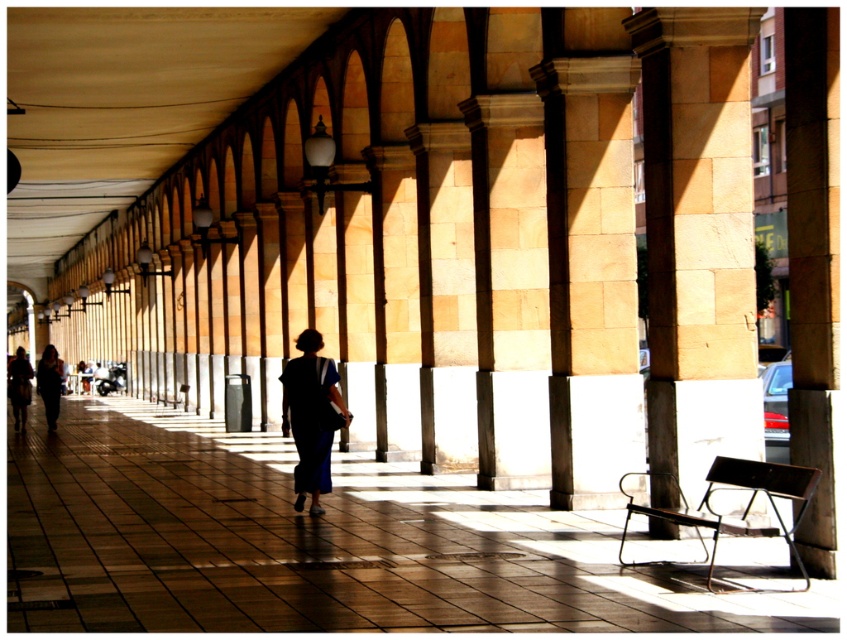
Question: Which point appears closest to the camera in this image?

Choices:
 (A) (832, 552)
 (B) (324, 445)
 (C) (21, 408)

Answer: (A)

Question: Among these objects, which one is nearest to the camera?

Choices:
 (A) dark blue dress at center
 (B) metallic brown chair at lower right
 (C) beige stone pillar at center
 (D) brown tile corridor at center

Answer: (D)

Question: Which object appears farthest from the camera in this image?

Choices:
 (A) dark blue dress at center
 (B) beige stone pillar at center
 (C) smooth stone pillar at center
 (D) dark blue fabric dress at center

Answer: (A)

Question: From the image, what is the correct spatial relationship of dark blue fabric dress at center in relation to dark blue fabric at center?

Choices:
 (A) above
 (B) below

Answer: (A)

Question: Is dark blue fabric dress at center thinner than dark blue fabric at center?

Choices:
 (A) yes
 (B) no

Answer: (A)

Question: Considering the relative positions of metallic brown chair at lower right and dark blue dress at center in the image provided, where is metallic brown chair at lower right located with respect to dark blue dress at center?

Choices:
 (A) below
 (B) above

Answer: (B)